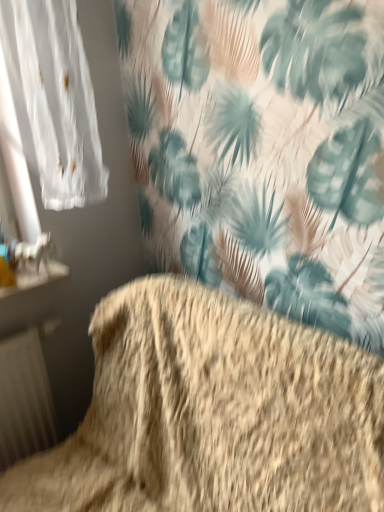
In order to face beige textured cushion at lower center, should I rotate leftwards or rightwards?

To face it directly, rotate left by 2.781 degrees.

Measure the distance between point (151, 324) and camera.

Point (151, 324) is 1.20 meters from camera.

This screenshot has height=512, width=384. Find the location of `beige textured cushion at lower center`. beige textured cushion at lower center is located at coordinates (213, 414).

The image size is (384, 512). What do you see at coordinates (213, 414) in the screenshot?
I see `beige textured cushion at lower center` at bounding box center [213, 414].

Where is `beige textured cushion at lower center`? beige textured cushion at lower center is located at coordinates (213, 414).